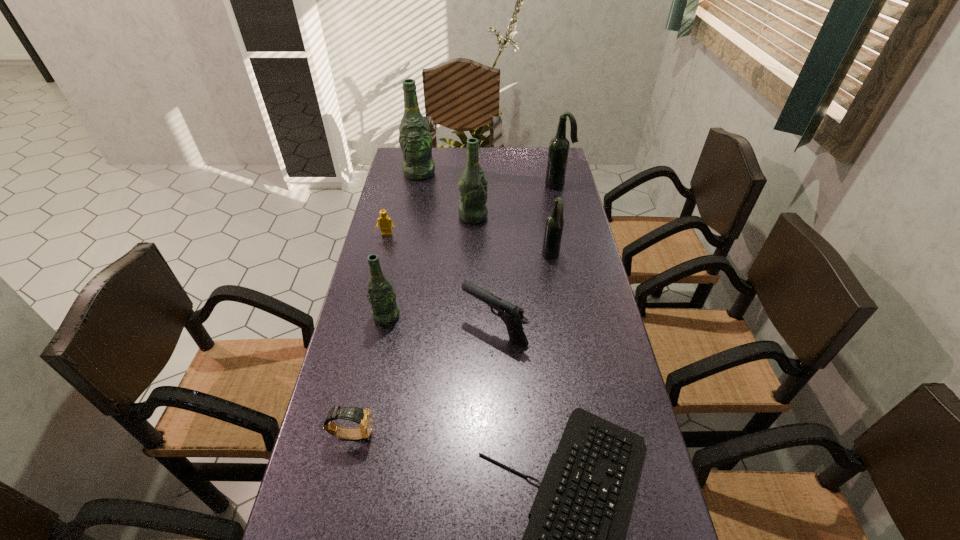
Where is `vacant space that satisfies the following two spatial constraints: 1. on the surface of the tallest beer bottle; 2. on the left side of the second nearest beer bottle`? The height and width of the screenshot is (540, 960). vacant space that satisfies the following two spatial constraints: 1. on the surface of the tallest beer bottle; 2. on the left side of the second nearest beer bottle is located at coordinates (404, 255).

I want to click on vacant area in the image that satisfies the following two spatial constraints: 1. on the surface of the rightmost green beer bottle; 2. on the face of the Lego, so click(473, 234).

The width and height of the screenshot is (960, 540). What are the coordinates of `free space that satisfies the following two spatial constraints: 1. on the surface of the rightmost green beer bottle; 2. on the face of the Lego` in the screenshot? It's located at (473, 234).

The height and width of the screenshot is (540, 960). I want to click on free location that satisfies the following two spatial constraints: 1. on the surface of the third farthest object; 2. on the face of the fourth farthest object, so click(473, 234).